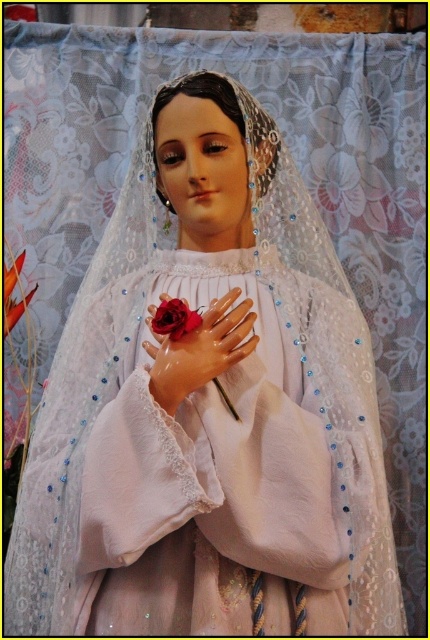
Question: Among these objects, which one is farthest from the camera?

Choices:
 (A) matte porcelain hand at center
 (B) matte red rose at center

Answer: (A)

Question: Which point is closer to the camera?

Choices:
 (A) matte porcelain hand at center
 (B) matte red rose at center

Answer: (B)

Question: Is matte porcelain hand at center bigger than matte red rose at center?

Choices:
 (A) yes
 (B) no

Answer: (A)

Question: Among these objects, which one is nearest to the camera?

Choices:
 (A) matte porcelain hand at center
 (B) matte red rose at center

Answer: (B)

Question: Is matte porcelain hand at center positioned behind matte red rose at center?

Choices:
 (A) no
 (B) yes

Answer: (B)

Question: Is matte porcelain hand at center to the right of matte red rose at center from the viewer's perspective?

Choices:
 (A) yes
 (B) no

Answer: (A)